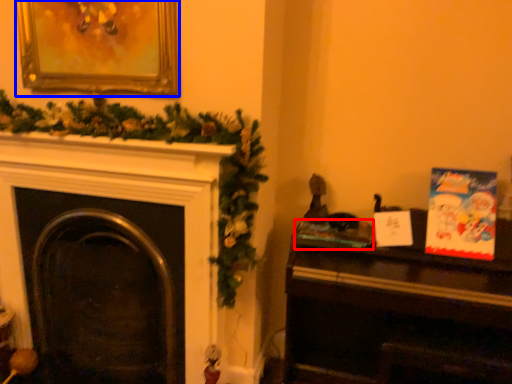
Question: Which object appears farthest to the camera in this image, book (highlighted by a red box) or picture frame (highlighted by a blue box)?

Choices:
 (A) book
 (B) picture frame

Answer: (A)